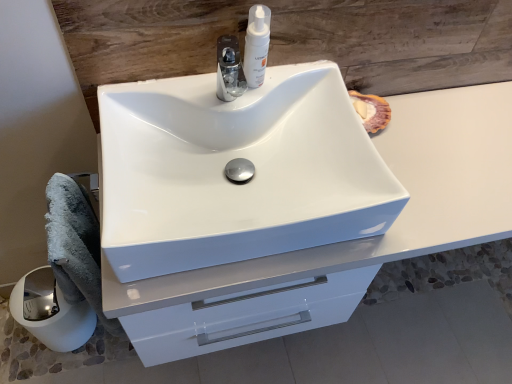
Question: Considering the relative sizes of white glossy sink at center and white glossy pump at upper center in the image provided, is white glossy sink at center thinner than white glossy pump at upper center?

Choices:
 (A) yes
 (B) no

Answer: (B)

Question: Is white glossy sink at center not within white glossy pump at upper center?

Choices:
 (A) no
 (B) yes

Answer: (B)

Question: From a real-world perspective, is white glossy sink at center located beneath white glossy pump at upper center?

Choices:
 (A) no
 (B) yes

Answer: (B)

Question: From the image's perspective, does white glossy sink at center appear higher than white glossy pump at upper center?

Choices:
 (A) no
 (B) yes

Answer: (A)

Question: From a real-world perspective, does white glossy sink at center stand above white glossy pump at upper center?

Choices:
 (A) yes
 (B) no

Answer: (B)

Question: Is white glossy pump at upper center inside white glossy sink at center?

Choices:
 (A) no
 (B) yes

Answer: (A)

Question: Does white glossy cabinet at center appear on the right side of white glossy paper towel at lower left?

Choices:
 (A) yes
 (B) no

Answer: (A)

Question: Is white glossy cabinet at center far from white glossy paper towel at lower left?

Choices:
 (A) yes
 (B) no

Answer: (B)

Question: Is white glossy paper towel at lower left at the back of white glossy cabinet at center?

Choices:
 (A) no
 (B) yes

Answer: (A)

Question: Is white glossy cabinet at center thinner than white glossy paper towel at lower left?

Choices:
 (A) yes
 (B) no

Answer: (B)

Question: Could you tell me if white glossy cabinet at center is facing white glossy paper towel at lower left?

Choices:
 (A) yes
 (B) no

Answer: (B)

Question: Can you confirm if white glossy cabinet at center is wider than white glossy paper towel at lower left?

Choices:
 (A) no
 (B) yes

Answer: (B)

Question: Is white glossy paper towel at lower left completely or partially outside of gray fluffy bath towel at lower left?

Choices:
 (A) no
 (B) yes

Answer: (B)